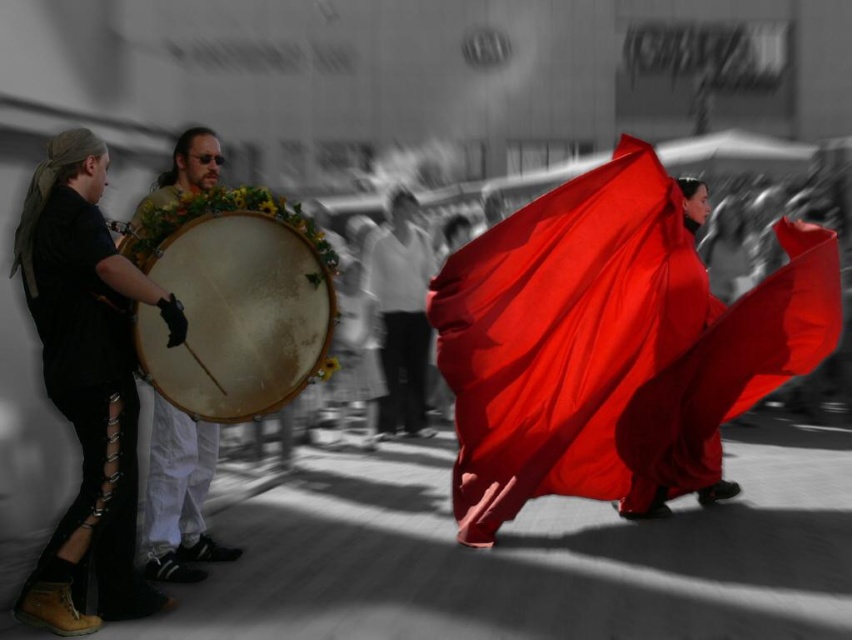
Question: Which point appears closest to the camera in this image?

Choices:
 (A) (795, 296)
 (B) (102, 301)
 (C) (171, 576)

Answer: (B)

Question: Is matte black dress at left smaller than wooden drum at center?

Choices:
 (A) no
 (B) yes

Answer: (A)

Question: Among these points, which one is nearest to the camera?

Choices:
 (A) (395, 280)
 (B) (544, 451)
 (C) (154, 572)

Answer: (C)

Question: Which of these objects is positioned closest to the smooth white shirt at center?

Choices:
 (A) matte red fabric at center
 (B) matte black dress at left
 (C) wooden drum at center

Answer: (A)

Question: Does matte red fabric at center appear on the left side of wooden drum at center?

Choices:
 (A) yes
 (B) no

Answer: (B)

Question: Is the position of matte red fabric at center less distant than that of wooden drum at left?

Choices:
 (A) yes
 (B) no

Answer: (B)